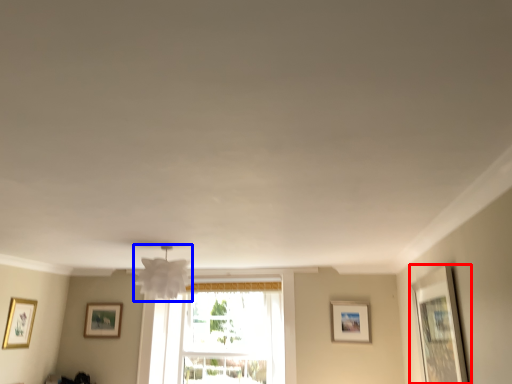
Question: Which point is further to the camera, picture frame (highlighted by a red box) or lamp (highlighted by a blue box)?

Choices:
 (A) picture frame
 (B) lamp

Answer: (B)